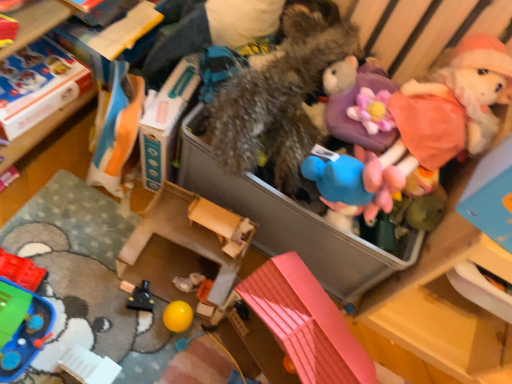
The width and height of the screenshot is (512, 384). I want to click on blue rubber duck at center, the second toy viewed from the right, so click(x=346, y=185).

Locate an element on the screen. The width and height of the screenshot is (512, 384). orange fabric bag at upper left, the 3th toy viewed from the left is located at coordinates click(117, 129).

What do you see at coordinates (290, 222) in the screenshot? I see `fuzzy fabric stuffed animal at center, which appears as the 1th storage box when viewed from the right` at bounding box center [290, 222].

What is the approximate width of fluffy plush doll at upper right, the eighth toy in the left-to-right sequence?

fluffy plush doll at upper right, the eighth toy in the left-to-right sequence, is 19.45 centimeters wide.

Describe the element at coordinates (298, 327) in the screenshot. I see `pink plastic toy house at lower center, the sixth toy positioned from the left` at that location.

Where is `blue rubber duck at center, the seventh toy when ordered from left to right`? This screenshot has height=384, width=512. blue rubber duck at center, the seventh toy when ordered from left to right is located at coordinates (346, 185).

Looking at this image, can you confirm if fuzzy brown plush at center, which is counted as the first clothing, starting from the left, is taller than cardboard box at upper left, which is counted as the third storage box, starting from the right?

Indeed, fuzzy brown plush at center, which is counted as the first clothing, starting from the left, has a greater height compared to cardboard box at upper left, which is counted as the third storage box, starting from the right.

You are a GUI agent. You are given a task and a screenshot of the screen. Output one action in this format:
    pyautogui.click(x=<x>, y=<y>)
    Task: Click on the clothing above the cardboard box at upper left, which is counted as the third storage box, starting from the right (from the image's perspective)
    The height and width of the screenshot is (384, 512).
    Given the screenshot: What is the action you would take?
    pyautogui.click(x=208, y=30)

Is fuzzy brown plush at center, which is the 2th clothing from right to left, facing towards cardboard box at upper left, which is counted as the third storage box, starting from the right?

No, fuzzy brown plush at center, which is the 2th clothing from right to left, is not turned towards cardboard box at upper left, which is counted as the third storage box, starting from the right.

Looking at the image, does fuzzy brown plush at center, which is counted as the first clothing, starting from the left, seem bigger or smaller compared to cardboard box at upper left, which is the 1th storage box from left to right?

fuzzy brown plush at center, which is counted as the first clothing, starting from the left, is bigger than cardboard box at upper left, which is the 1th storage box from left to right.

Is the surface of translucent plastic bricks at lower left, the 8th toy when ordered from right to left, in direct contact with blue rubber duck at center, the seventh toy when ordered from left to right?

They are not placed beside each other.

From the image's perspective, who appears lower, translucent plastic bricks at lower left, which is counted as the first toy, starting from the left, or blue rubber duck at center, the seventh toy when ordered from left to right?

translucent plastic bricks at lower left, which is counted as the first toy, starting from the left.

Is translucent plastic bricks at lower left, which is counted as the first toy, starting from the left, looking in the opposite direction of blue rubber duck at center, the second toy viewed from the right?

No, translucent plastic bricks at lower left, which is counted as the first toy, starting from the left, is not facing the opposite direction of blue rubber duck at center, the second toy viewed from the right.

How much distance is there between translucent plastic bricks at lower left, which is counted as the first toy, starting from the left, and blue rubber duck at center, the second toy viewed from the right?

translucent plastic bricks at lower left, which is counted as the first toy, starting from the left, and blue rubber duck at center, the second toy viewed from the right, are 29.05 inches apart from each other.

Between orange fabric bag at upper left, acting as the 6th toy starting from the right, and fuzzy brown plush at center, which is counted as the first clothing, starting from the left, which one appears on the left side from the viewer's perspective?

From the viewer's perspective, orange fabric bag at upper left, acting as the 6th toy starting from the right, appears more on the left side.

Which object is closer to the camera, orange fabric bag at upper left, the 3th toy viewed from the left, or fuzzy brown plush at center, which is the 2th clothing from right to left?

Positioned in front is fuzzy brown plush at center, which is the 2th clothing from right to left.

Considering the points (135, 94) and (252, 31), which point is behind, point (135, 94) or point (252, 31)?

The point (135, 94) is farther from the camera.

From a real-world perspective, is orange fabric bag at upper left, acting as the 6th toy starting from the right, physically located above or below fuzzy brown plush at center, which is the 2th clothing from right to left?

orange fabric bag at upper left, acting as the 6th toy starting from the right, is below fuzzy brown plush at center, which is the 2th clothing from right to left.

Which of these two, cardboard box at upper left, which is counted as the third storage box, starting from the right, or pink plastic toy house at lower center, the sixth toy positioned from the left, is wider?

pink plastic toy house at lower center, the sixth toy positioned from the left, is wider.

Looking at this image, is cardboard box at upper left, which is the 1th storage box from left to right, not within pink plastic toy house at lower center, which is the third toy from right to left?

Absolutely, cardboard box at upper left, which is the 1th storage box from left to right, is external to pink plastic toy house at lower center, which is the third toy from right to left.

Visually, is cardboard box at upper left, which is the 1th storage box from left to right, positioned to the left or to the right of pink plastic toy house at lower center, the sixth toy positioned from the left?

cardboard box at upper left, which is the 1th storage box from left to right, is positioned on pink plastic toy house at lower center, the sixth toy positioned from the left,'s left side.

Consider the image. How different are the orientations of cardboard box at upper left, which is counted as the third storage box, starting from the right, and pink plastic toy house at lower center, the sixth toy positioned from the left, in degrees?

The angle between the facing direction of cardboard box at upper left, which is counted as the third storage box, starting from the right, and the facing direction of pink plastic toy house at lower center, the sixth toy positioned from the left, is 116 degrees.

From the image's perspective, who appears lower, black plastic toy at lower left, acting as the fourth toy starting from the left, or blue rubber duck at center, the seventh toy when ordered from left to right?

black plastic toy at lower left, acting as the fourth toy starting from the left, is shown below in the image.

How many degrees apart are the facing directions of black plastic toy at lower left, acting as the fourth toy starting from the left, and blue rubber duck at center, the second toy viewed from the right?

They differ by 13.5 degrees in their facing directions.

Between black plastic toy at lower left, the fifth toy viewed from the right, and blue rubber duck at center, the seventh toy when ordered from left to right, which one has less height?

black plastic toy at lower left, the fifth toy viewed from the right, is shorter.

Between point (143, 296) and point (316, 157), which one is positioned behind?

The point (143, 296) is more distant.

From a real-world perspective, is purple fabric flower at upper center, placed as the first clothing when sorted from right to left, over fuzzy fabric stuffed animal at center, positioned as the third storage box in left-to-right order?

Correct, in the physical world, purple fabric flower at upper center, placed as the first clothing when sorted from right to left, is higher than fuzzy fabric stuffed animal at center, positioned as the third storage box in left-to-right order.

Is purple fabric flower at upper center, placed as the first clothing when sorted from right to left, completely or partially outside of fuzzy fabric stuffed animal at center, which appears as the 1th storage box when viewed from the right?

purple fabric flower at upper center, placed as the first clothing when sorted from right to left, lies outside fuzzy fabric stuffed animal at center, which appears as the 1th storage box when viewed from the right,'s area.

Considering the relative sizes of purple fabric flower at upper center, arranged as the second clothing when viewed from the left, and fuzzy fabric stuffed animal at center, which appears as the 1th storage box when viewed from the right, in the image provided, is purple fabric flower at upper center, arranged as the second clothing when viewed from the left, wider than fuzzy fabric stuffed animal at center, which appears as the 1th storage box when viewed from the right,?

No, purple fabric flower at upper center, arranged as the second clothing when viewed from the left, is not wider than fuzzy fabric stuffed animal at center, which appears as the 1th storage box when viewed from the right.

From the image's perspective, which object appears higher, purple fabric flower at upper center, arranged as the second clothing when viewed from the left, or fuzzy fabric stuffed animal at center, which appears as the 1th storage box when viewed from the right?

purple fabric flower at upper center, arranged as the second clothing when viewed from the left, appears higher in the image.

Relative to wooden dollhouse at center, which is the 2th storage box in left-to-right order, is fuzzy brown plush at center, which is counted as the first clothing, starting from the left, in front or behind?

fuzzy brown plush at center, which is counted as the first clothing, starting from the left, is positioned closer to the viewer than wooden dollhouse at center, which is the 2th storage box in left-to-right order.

There is a wooden dollhouse at center, which is the 2th storage box in left-to-right order. Identify the location of the 1st clothing above it (from a real-world perspective). click(208, 30).

Who is smaller, fuzzy brown plush at center, which is counted as the first clothing, starting from the left, or wooden dollhouse at center, acting as the 2th storage box starting from the right?

wooden dollhouse at center, acting as the 2th storage box starting from the right.

From the picture: Is fuzzy brown plush at center, which is the 2th clothing from right to left, at the left side of wooden dollhouse at center, which is the 2th storage box in left-to-right order?

Incorrect, fuzzy brown plush at center, which is the 2th clothing from right to left, is not on the left side of wooden dollhouse at center, which is the 2th storage box in left-to-right order.

Identify the location of the 2nd storage box to the left of the fuzzy brown plush at center, which is the 2th clothing from right to left, counting from the anchor's position. The image size is (512, 384). (38, 85).

From a real-world perspective, starting from the blue rubber duck at center, the seventh toy when ordered from left to right, which toy is the 4th one below it? Please provide its 2D coordinates.

[(21, 271)]

Considering their positions, is fuzzy brown plush at center, which is the 2th clothing from right to left, positioned further to black plastic toy at lower left, the fifth toy viewed from the right, than pink plastic toy house at lower center, the sixth toy positioned from the left?

fuzzy brown plush at center, which is the 2th clothing from right to left, lies further to black plastic toy at lower left, the fifth toy viewed from the right, than the other object.

Considering their positions, is translucent plastic bricks at lower left, which is counted as the first toy, starting from the left, positioned further to fluffy plush doll at upper right, which appears as the first toy when viewed from the right, than wooden dollhouse at center, acting as the 2th storage box starting from the right?

translucent plastic bricks at lower left, which is counted as the first toy, starting from the left.

From the image, which object appears to be farther from fuzzy fabric stuffed animal at center, the fifth toy in the left-to-right sequence, wooden dollhouse at center, acting as the 2th storage box starting from the right, or fuzzy fabric stuffed animal at center, which appears as the 1th storage box when viewed from the right?

wooden dollhouse at center, acting as the 2th storage box starting from the right.

Considering their positions, is translucent plastic bricks at lower left, which is counted as the first toy, starting from the left, positioned closer to fuzzy brown plush at center, which is the 2th clothing from right to left, than fuzzy fabric stuffed animal at center, the fifth toy in the left-to-right sequence?

The object closer to fuzzy brown plush at center, which is the 2th clothing from right to left, is fuzzy fabric stuffed animal at center, the fifth toy in the left-to-right sequence.

From the image, which object appears to be farther from black plastic toy at lower left, acting as the fourth toy starting from the left, translucent plastic bricks at lower left, the 8th toy when ordered from right to left, or cardboard box at upper left, which is counted as the third storage box, starting from the right?

cardboard box at upper left, which is counted as the third storage box, starting from the right, is further to black plastic toy at lower left, acting as the fourth toy starting from the left.

When comparing their distances from blue rubber duck at center, the second toy viewed from the right, does wooden dollhouse at center, which is the 2th storage box in left-to-right order, or fuzzy brown plush at center, which is the 2th clothing from right to left, seem further?

fuzzy brown plush at center, which is the 2th clothing from right to left, is further to blue rubber duck at center, the second toy viewed from the right.

Considering their positions, is fluffy plush doll at upper right, which appears as the first toy when viewed from the right, positioned further to fuzzy fabric stuffed animal at center, the fifth toy in the left-to-right sequence, than pink plastic toy house at lower center, which is the third toy from right to left?

pink plastic toy house at lower center, which is the third toy from right to left, lies further to fuzzy fabric stuffed animal at center, the fifth toy in the left-to-right sequence, than the other object.

From the image, which object appears to be nearer to fluffy plush doll at upper right, the eighth toy in the left-to-right sequence, wooden dollhouse at center, which is the 2th storage box in left-to-right order, or fuzzy fabric stuffed animal at center, which appears as the 1th storage box when viewed from the right?

The object closer to fluffy plush doll at upper right, the eighth toy in the left-to-right sequence, is fuzzy fabric stuffed animal at center, which appears as the 1th storage box when viewed from the right.

Locate an element on the screen. The height and width of the screenshot is (384, 512). storage box between purple fabric flower at upper center, arranged as the second clothing when viewed from the left, and blue rubber duck at center, the seventh toy when ordered from left to right, from top to bottom is located at coordinates (290, 222).

The image size is (512, 384). I want to click on storage box between orange fabric bag at upper left, the 3th toy viewed from the left, and fuzzy fabric stuffed animal at center, positioned as the third storage box in left-to-right order, in the horizontal direction, so click(183, 246).

Find the location of a particular element. The height and width of the screenshot is (384, 512). storage box located between translucent plastic bricks at lower left, which is counted as the first toy, starting from the left, and fuzzy fabric stuffed animal at center, positioned as the third storage box in left-to-right order, in the left-right direction is located at coordinates (183, 246).

I want to click on storage box situated between fuzzy brown plush at center, which is the 2th clothing from right to left, and fluffy plush doll at upper right, the eighth toy in the left-to-right sequence, from left to right, so click(x=290, y=222).